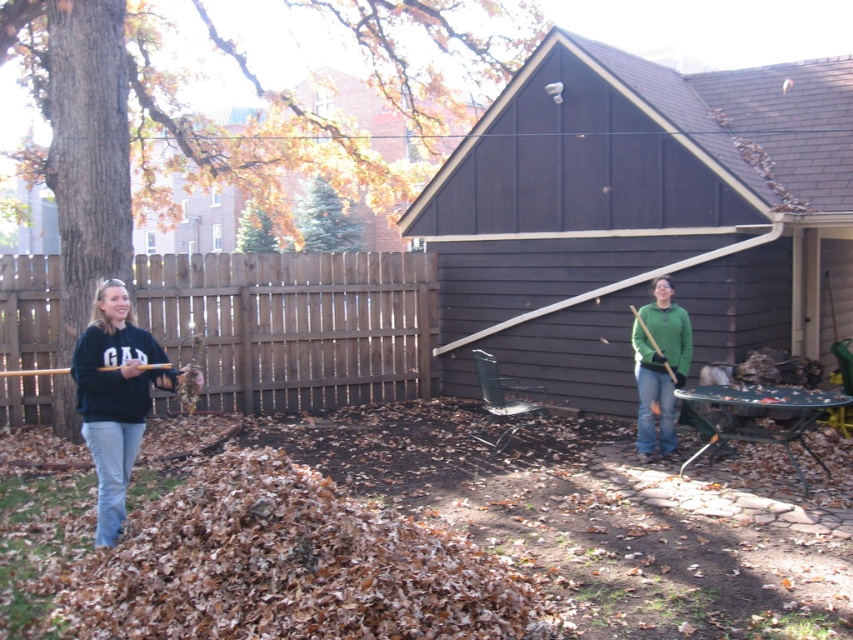
You are standing in the backyard and see the black sweatshirt at left and the green matte sweater at center. Which one is closer to the fence on the right side of the yard?

The green matte sweater at center is closer to the fence on the right side of the yard because the black sweatshirt at left is to the left of it, meaning the green matte sweater at center is positioned between the black sweatshirt at left and the fence on the right.

You are standing in the backyard and want to place a small potted plant between the two points marked as point (236, 376) and point (119, 365). Which point should the plant be closer to in order to be nearer to the camera?

The small potted plant should be placed closer to point (119, 365) because it is closer to the camera compared to point (236, 376).